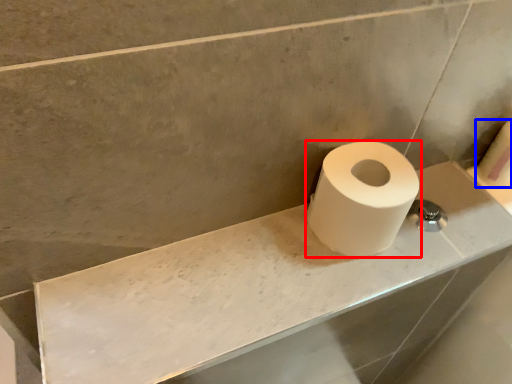
Question: Among these objects, which one is farthest to the camera, toilet paper (highlighted by a red box) or toilet paper (highlighted by a blue box)?

Choices:
 (A) toilet paper
 (B) toilet paper

Answer: (B)